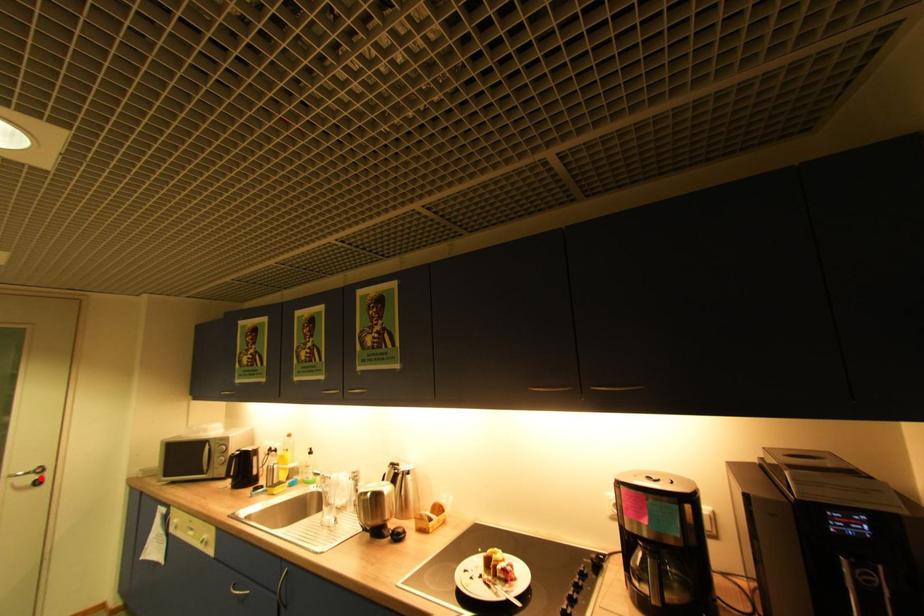
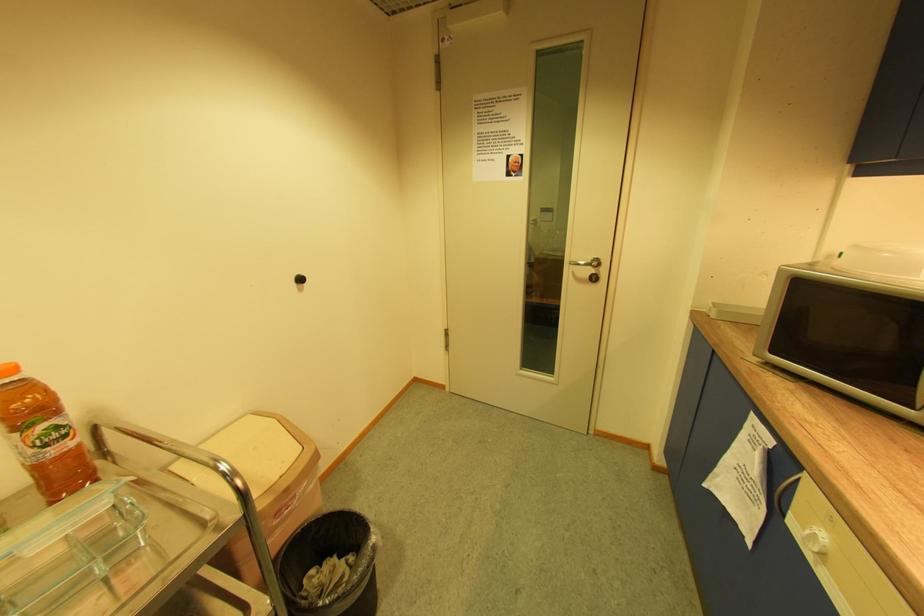
Locate, in the second image, the point that corresponds to the highlighted location in the first image.

(598, 272)